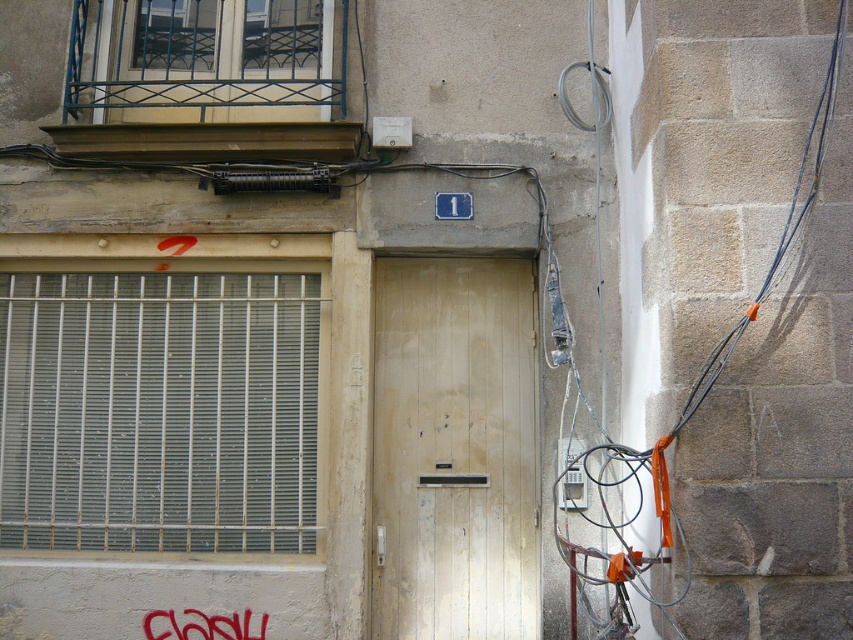
You are an artist planning to paint a mural on the building facade. You notice the orange fabric at right and the brushed metal graffiti at lower left. Which object should you avoid painting over if you want to preserve the taller one?

The orange fabric at right is taller than the brushed metal graffiti at lower left, so you should avoid painting over the orange fabric at right to preserve the taller one.

You are standing in front of the building shown in the image. There is a point marked at coordinates [724,397]. According to the scene description, what object or material is located at that point?

The point is on orange fabric at right.